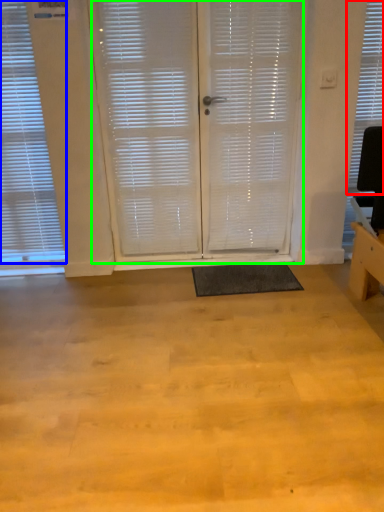
Question: Estimate the real-world distances between objects in this image. Which object is farther from window blind (highlighted by a red box), window blind (highlighted by a blue box) or screen door (highlighted by a green box)?

Choices:
 (A) window blind
 (B) screen door

Answer: (A)